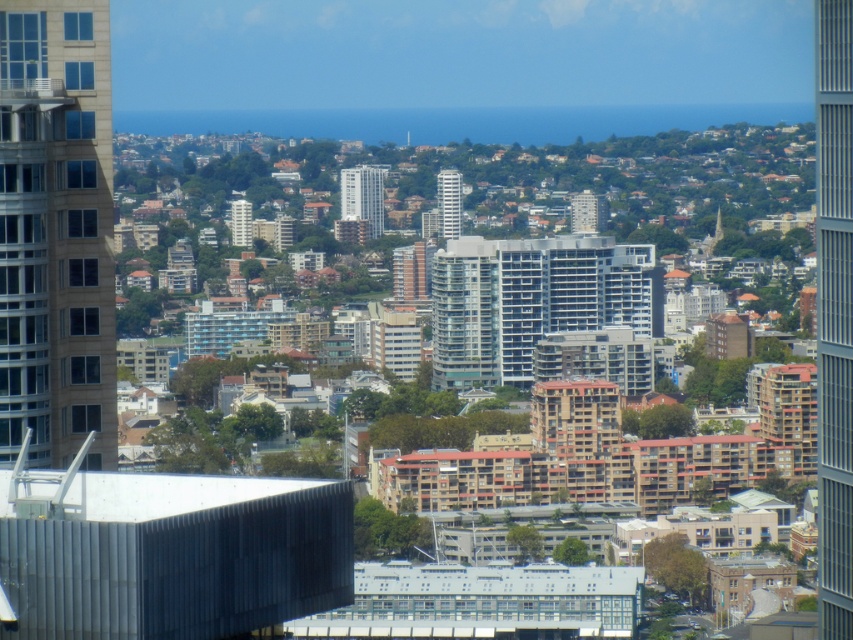
You are an urban planner assessing the city layout. You need to determine which building has a greater floor area for potential commercial use. Based on the provided image, which building between the beige glass building at left and the white glossy building at center would you recommend?

The beige glass building at left is larger in size than the white glossy building at center, so it has a greater floor area and would be more suitable for commercial use.

You are a delivery drone that needs to fly between the white glossy building at center and the matte gray building at center. What is the minimum distance you must maintain to safely navigate between them?

The minimum distance you must maintain to safely navigate between the white glossy building at center and the matte gray building at center is 156.27 feet.

You are an urban planner reviewing the city layout. You need to determine the spatial relationship between the beige glass building at left and the white glossy building at center. Which one is positioned lower in the image?

The beige glass building at left is located below the white glossy building at center, so it is positioned lower in the image.